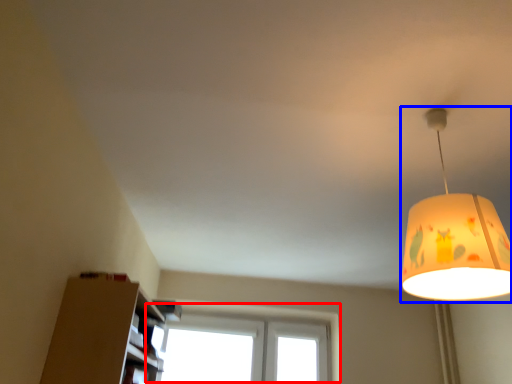
Question: Among these objects, which one is nearest to the camera, window (highlighted by a red box) or lamp (highlighted by a blue box)?

Choices:
 (A) window
 (B) lamp

Answer: (B)